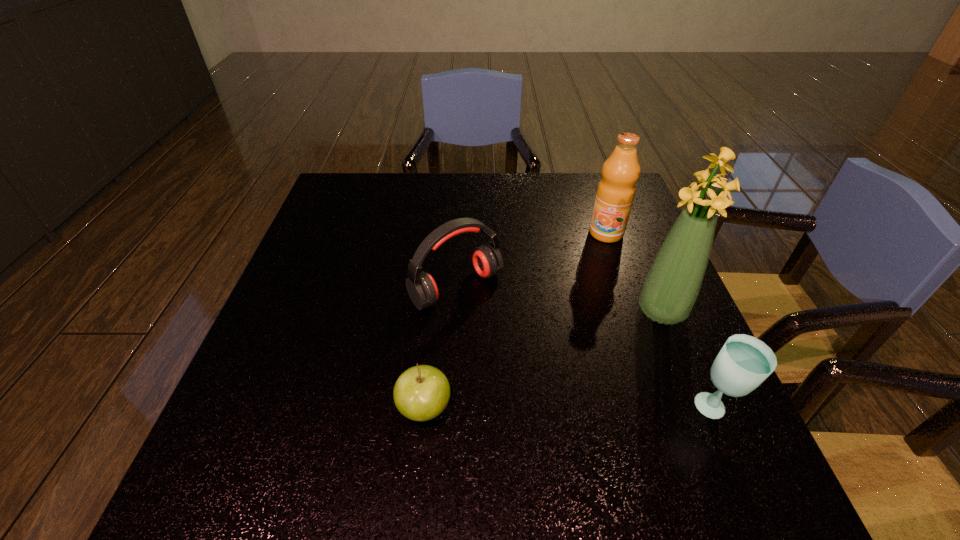
Locate an element on the screen. The width and height of the screenshot is (960, 540). fruit juice at the right edge is located at coordinates (615, 194).

The width and height of the screenshot is (960, 540). I want to click on bouquet at the right edge, so click(671, 287).

In order to click on object located in the near right corner section of the desktop in this screenshot , I will do `click(744, 362)`.

Find the location of a particular element. Image resolution: width=960 pixels, height=540 pixels. vacant space at the far edge of the desktop is located at coordinates (447, 209).

Locate an element on the screen. vacant space at the near edge of the desktop is located at coordinates (477, 423).

At what (x,y) coordinates should I click in order to perform the action: click on vacant space at the left edge. Please return your answer as a coordinate pair (x, y). Looking at the image, I should click on (269, 364).

Locate an element on the screen. Image resolution: width=960 pixels, height=540 pixels. free point at the right edge is located at coordinates tap(599, 242).

Identify the location of free location at the near left corner of the desktop. The image size is (960, 540). (304, 421).

Find the location of `unoccupied position between the apple and the earphone`. unoccupied position between the apple and the earphone is located at coordinates (441, 348).

I want to click on vacant space that's between the shortest object and the glass, so click(569, 408).